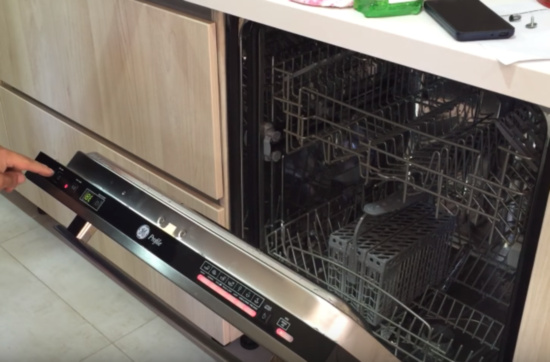
Identify the location of kitchen floor tile. click(x=36, y=305).